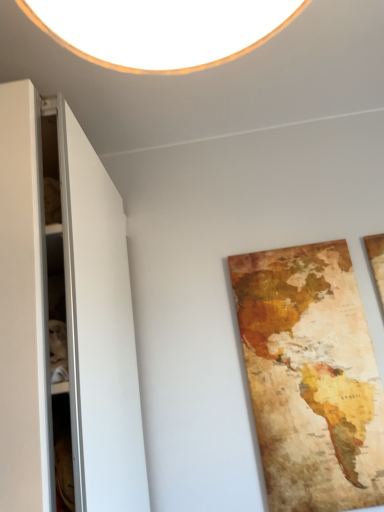
Describe the element at coordinates (311, 377) in the screenshot. This screenshot has width=384, height=512. I see `watercolor map at right` at that location.

Identify the location of watercolor map at right. This screenshot has width=384, height=512. (311, 377).

Consider the image. What is the approximate height of watercolor map at right?

32.58 inches.

Where is `watercolor map at right`? This screenshot has height=512, width=384. watercolor map at right is located at coordinates (311, 377).